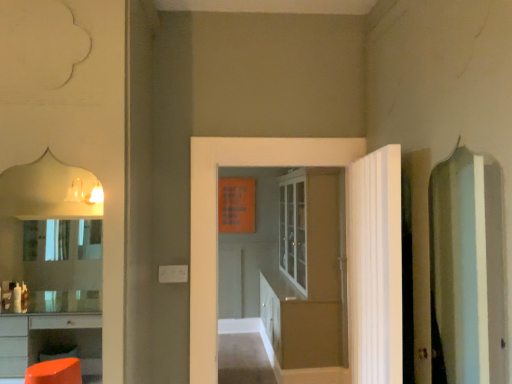
Question: In terms of width, does white textured door at right, placed as the first door when sorted from front to back, look wider or thinner when compared to white glossy door at center, which is the 2th door in back-to-front order?

Choices:
 (A) thin
 (B) wide

Answer: (B)

Question: Relative to white glossy door at center, which is the 2th door in back-to-front order, is white textured door at right, placed as the first door when sorted from front to back, in front or behind?

Choices:
 (A) front
 (B) behind

Answer: (A)

Question: Which of these objects is positioned closest to the white glossy door at center, which is the 2th door in back-to-front order?

Choices:
 (A) matte glass cabinet at center, which is the 3th door from front to back
 (B) white textured door at right, positioned as the third door in back-to-front order

Answer: (B)

Question: Which of these objects is positioned closest to the white textured door at right, positioned as the third door in back-to-front order?

Choices:
 (A) matte glass cabinet at center, which is counted as the 1th door, starting from the back
 (B) white glossy door at center, acting as the second door starting from the front

Answer: (B)